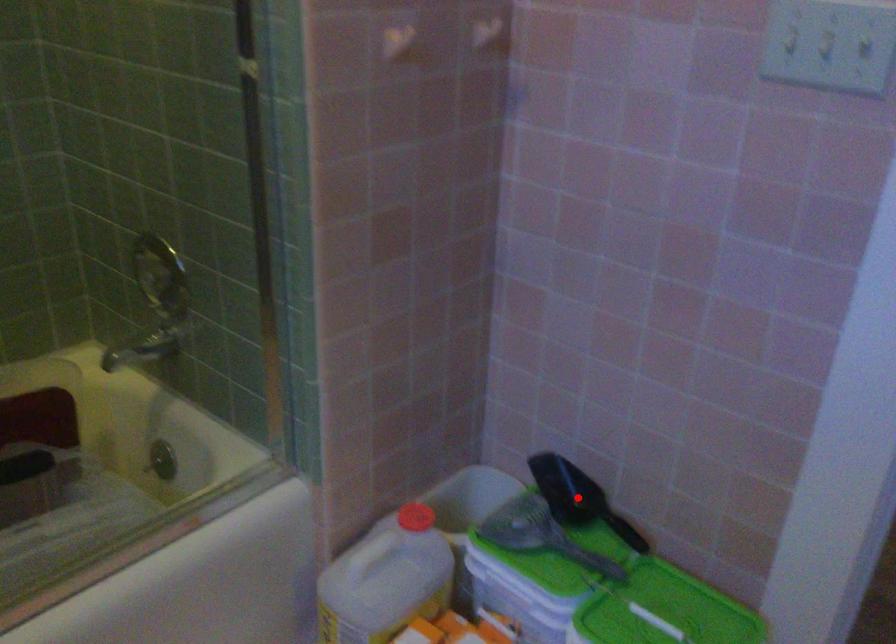
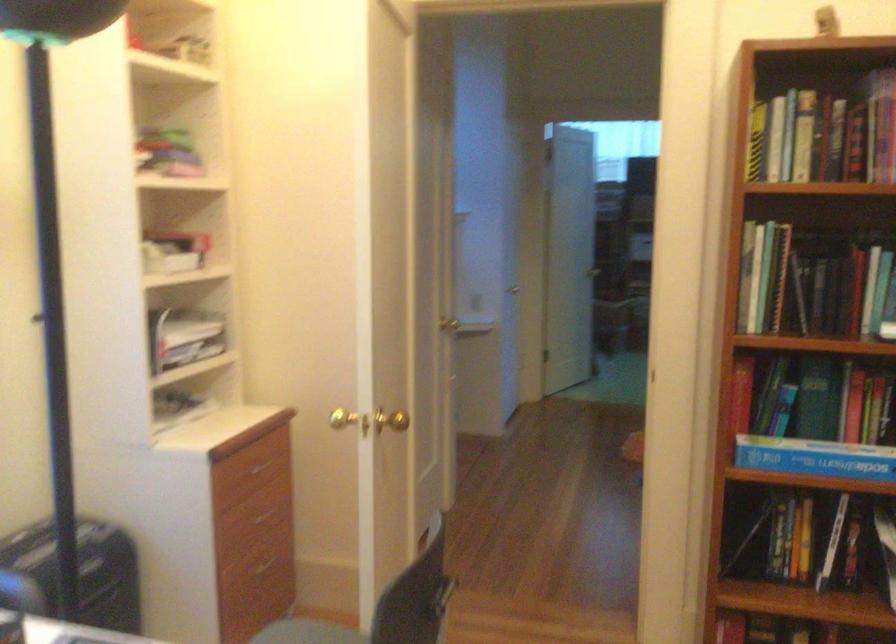
Question: I am providing you with two images of the same scene from different viewpoints. A red point is marked on the first image. Can you still see the location of the red point in image 2?

Choices:
 (A) Yes
 (B) No

Answer: (B)